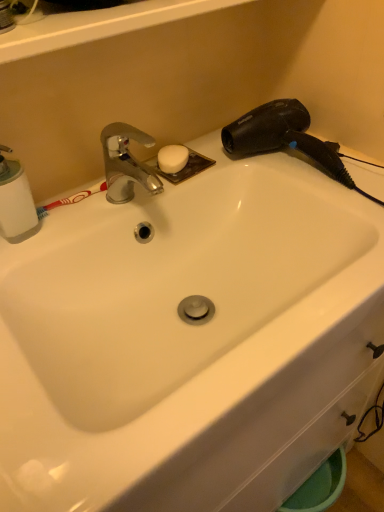
Identify the location of free space to the left of black matte hair dryer at upper right. (189, 167).